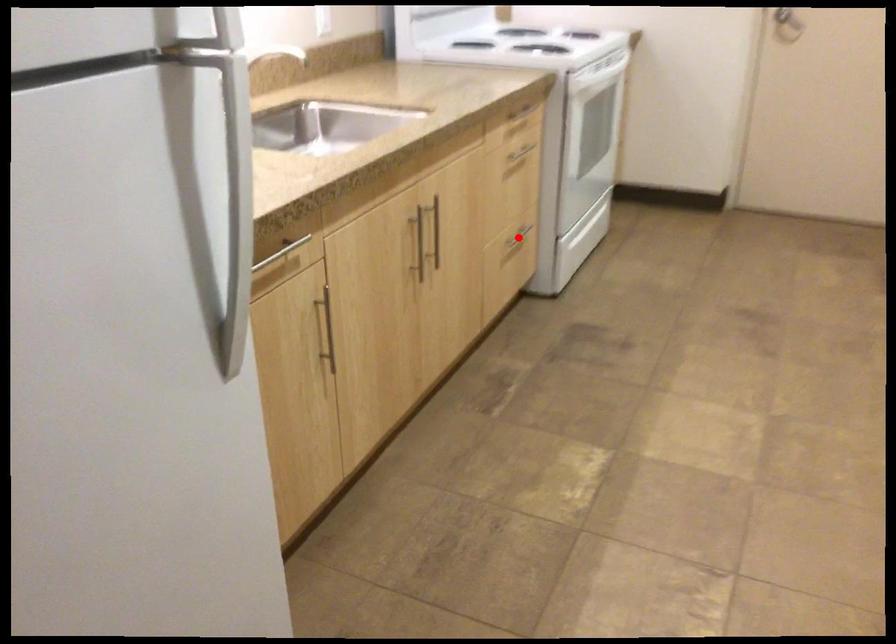
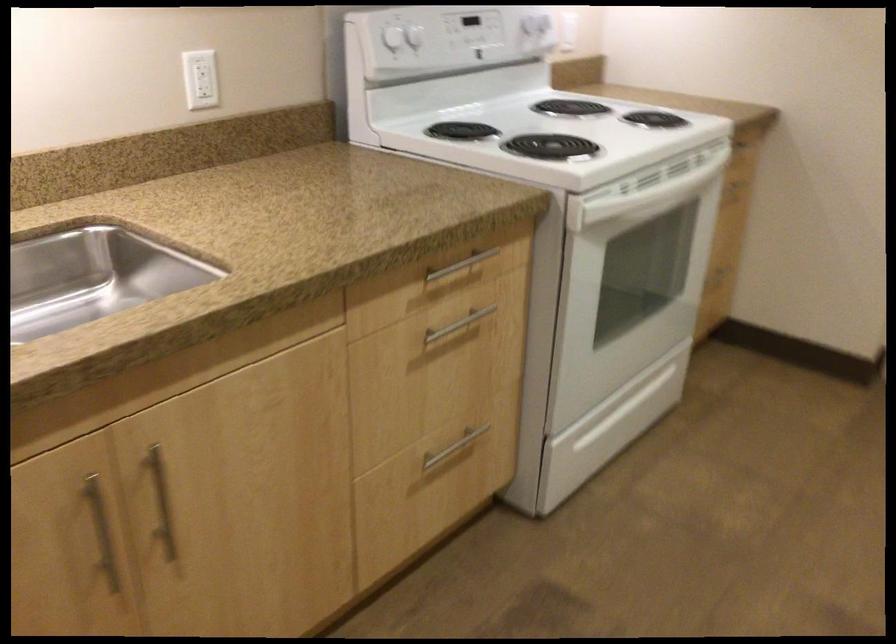
Question: I am providing you with two images of the same scene from different viewpoints. A red point is shown in image1. For the corresponding object point in image2, is it positioned nearer or farther from the camera?

Choices:
 (A) Nearer
 (B) Farther

Answer: (A)